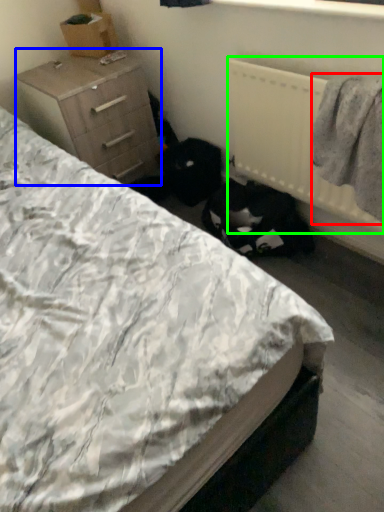
Question: Which object is positioned closest to clothing (highlighted by a red box)? Select from chest of drawers (highlighted by a blue box) and radiator (highlighted by a green box).

Choices:
 (A) chest of drawers
 (B) radiator

Answer: (B)